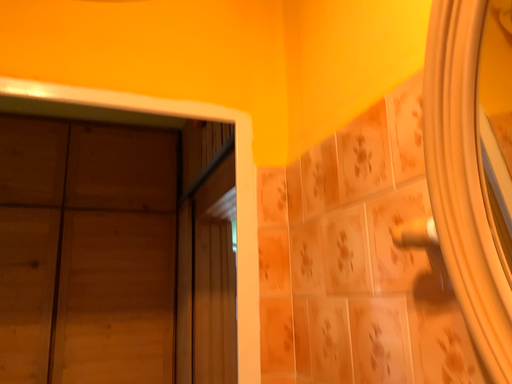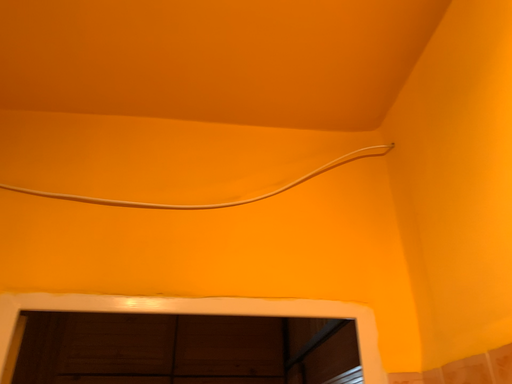
Question: How did the camera likely rotate when shooting the video?

Choices:
 (A) rotated upward
 (B) rotated downward

Answer: (A)